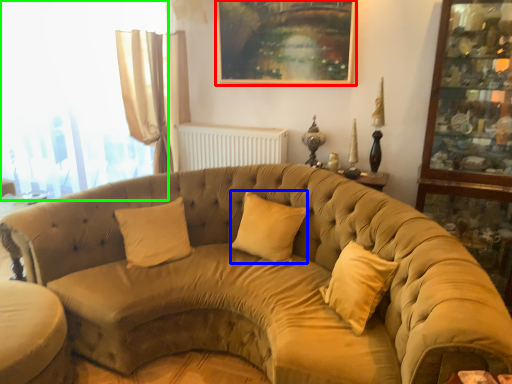
Question: Which is farther away from picture frame (highlighted by a red box)? pillow (highlighted by a blue box) or window (highlighted by a green box)?

Choices:
 (A) pillow
 (B) window

Answer: (B)